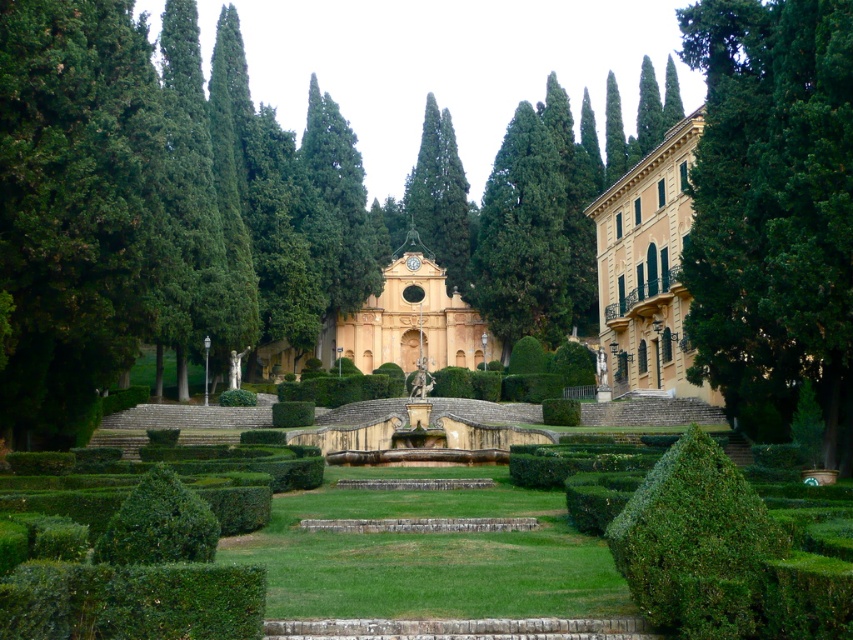
Question: Is green leafy bush at center above beige stucco palace at right?

Choices:
 (A) yes
 (B) no

Answer: (B)

Question: Is green textured tree at center wider than matte yellow palace at center?

Choices:
 (A) yes
 (B) no

Answer: (B)

Question: Which of the following is the farthest from the observer?

Choices:
 (A) matte yellow palace at center
 (B) green leafy bush at lower left

Answer: (A)

Question: Estimate the real-world distances between objects in this image. Which object is farther from the beige stucco palace at right?

Choices:
 (A) green leafy bush at center
 (B) green textured tree at center
 (C) green leafy bush at lower left
 (D) matte yellow palace at center

Answer: (C)

Question: Does green leafy bush at center appear on the right side of matte yellow palace at center?

Choices:
 (A) yes
 (B) no

Answer: (A)

Question: Which of the following is the closest to the observer?

Choices:
 (A) (692, 310)
 (B) (686, 307)
 (C) (155, 490)

Answer: (C)